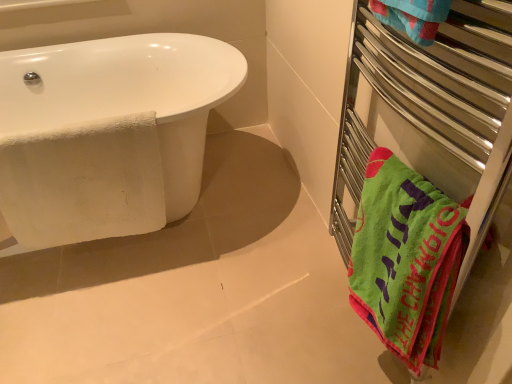
Image resolution: width=512 pixels, height=384 pixels. Find the location of `white textured towel at left`. white textured towel at left is located at coordinates (83, 182).

You are a GUI agent. You are given a task and a screenshot of the screen. Output one action in this format:
    pyautogui.click(x=<x>, y=<y>)
    Task: Click on the green fabric towel at right
    
    Given the screenshot: What is the action you would take?
    pyautogui.click(x=426, y=93)

The height and width of the screenshot is (384, 512). Find the location of `white textured towel at left`. white textured towel at left is located at coordinates (83, 182).

Which point is more distant from viewer, (145, 114) or (453, 61)?

Point (145, 114)

From a real-world perspective, which is physically above, white textured towel at left or green fabric towel at right?

In real-world perspective, green fabric towel at right is above.

Can you tell me how much white textured towel at left and green fabric towel at right differ in facing direction?

There is a 91.6-degree angle between the facing directions of white textured towel at left and green fabric towel at right.

Considering the relative sizes of white textured towel at left and green fabric towel at right in the image provided, is white textured towel at left smaller than green fabric towel at right?

Indeed, white textured towel at left has a smaller size compared to green fabric towel at right.

From the image's perspective, is green fabric towel at right positioned above or below green soft towel at right?

green fabric towel at right is situated higher than green soft towel at right in the image.

Considering the sizes of green fabric towel at right and green soft towel at right in the image, is green fabric towel at right wider or thinner than green soft towel at right?

green fabric towel at right is wider than green soft towel at right.

Would you say green fabric towel at right contains green soft towel at right?

Yes, green fabric towel at right contains green soft towel at right.

Considering the sizes of white glossy bathtub at left and white textured towel at left in the image, is white glossy bathtub at left bigger or smaller than white textured towel at left?

white glossy bathtub at left is bigger than white textured towel at left.

Consider the image. Does white glossy bathtub at left have a lesser width compared to white textured towel at left?

No, white glossy bathtub at left is not thinner than white textured towel at left.

Does point (167, 130) appear closer or farther from the camera than point (106, 220)?

Clearly, point (167, 130) is closer to the camera than point (106, 220).

From the image's perspective, is white glossy bathtub at left located above white textured towel at left?

Yes, from the image's perspective, white glossy bathtub at left is over white textured towel at left.

From a real-world perspective, is white glossy bathtub at left beneath green soft towel at right?

Indeed, from a real-world perspective, white glossy bathtub at left is positioned beneath green soft towel at right.

Does white glossy bathtub at left appear on the left side of green soft towel at right?

Correct, you'll find white glossy bathtub at left to the left of green soft towel at right.

Can we say white glossy bathtub at left lies outside green soft towel at right?

white glossy bathtub at left is positioned outside green soft towel at right.

From the image's perspective, who appears lower, white glossy bathtub at left or green soft towel at right?

green soft towel at right.

Does green soft towel at right have a smaller size compared to green fabric towel at right?

Correct, green soft towel at right occupies less space than green fabric towel at right.

From the picture: From a real-world perspective, is green soft towel at right under green fabric towel at right?

Indeed, from a real-world perspective, green soft towel at right is positioned beneath green fabric towel at right.

From the image's perspective, which is above, white glossy bathtub at left or green fabric towel at right?

white glossy bathtub at left, from the image's perspective.

What's the angular difference between white glossy bathtub at left and green fabric towel at right's facing directions?

They differ by 90 degrees in their facing directions.

Identify the location of bathtub on the left of green fabric towel at right. pyautogui.click(x=127, y=95).

Looking at this image, is white glossy bathtub at left facing towards green fabric towel at right?

Yes, white glossy bathtub at left is oriented towards green fabric towel at right.

Between white textured towel at left and green soft towel at right, which one has smaller size?

white textured towel at left is smaller.

Is green soft towel at right a part of white textured towel at left?

No, white textured towel at left does not contain green soft towel at right.

Considering the relative sizes of white textured towel at left and green soft towel at right in the image provided, is white textured towel at left wider than green soft towel at right?

No.

Where is `beach towel that appears below the green fabric towel at right (from a real-world perspective)`? beach towel that appears below the green fabric towel at right (from a real-world perspective) is located at coordinates (83, 182).

The image size is (512, 384). Find the location of `towel below the green fabric towel at right (from the image's perspective)`. towel below the green fabric towel at right (from the image's perspective) is located at coordinates (406, 259).

From the image, which object appears to be farther from white glossy bathtub at left, white textured towel at left or green fabric towel at right?

green fabric towel at right is positioned further to the anchor white glossy bathtub at left.

Which object lies nearer to the anchor point white textured towel at left, white glossy bathtub at left or green soft towel at right?

white glossy bathtub at left is positioned closer to the anchor white textured towel at left.

From the image, which object appears to be farther from white textured towel at left, green fabric towel at right or white glossy bathtub at left?

Based on the image, green fabric towel at right appears to be further to white textured towel at left.

When comparing their distances from green soft towel at right, does white glossy bathtub at left or green fabric towel at right seem further?

Among the two, white glossy bathtub at left is located further to green soft towel at right.

Estimate the real-world distances between objects in this image. Which object is further from green soft towel at right, green fabric towel at right or white glossy bathtub at left?

Based on the image, white glossy bathtub at left appears to be further to green soft towel at right.

Based on their spatial positions, is white textured towel at left or green soft towel at right further from green fabric towel at right?

white textured towel at left is further to green fabric towel at right.

Estimate the real-world distances between objects in this image. Which object is further from green fabric towel at right, white glossy bathtub at left or white textured towel at left?

white glossy bathtub at left is positioned further to the anchor green fabric towel at right.

In the scene shown: Looking at the image, which one is located further to green fabric towel at right, white textured towel at left or white glossy bathtub at left?

Based on the image, white glossy bathtub at left appears to be further to green fabric towel at right.

Image resolution: width=512 pixels, height=384 pixels. I want to click on beach towel between white glossy bathtub at left and green fabric towel at right from left to right, so click(x=83, y=182).

Locate an element on the screen. beach towel between white glossy bathtub at left and green soft towel at right from left to right is located at coordinates (83, 182).

Locate an element on the screen. This screenshot has height=384, width=512. towel situated between white textured towel at left and green fabric towel at right from left to right is located at coordinates (406, 259).

Locate an element on the screen. Image resolution: width=512 pixels, height=384 pixels. towel located between white glossy bathtub at left and green fabric towel at right in the left-right direction is located at coordinates (406, 259).